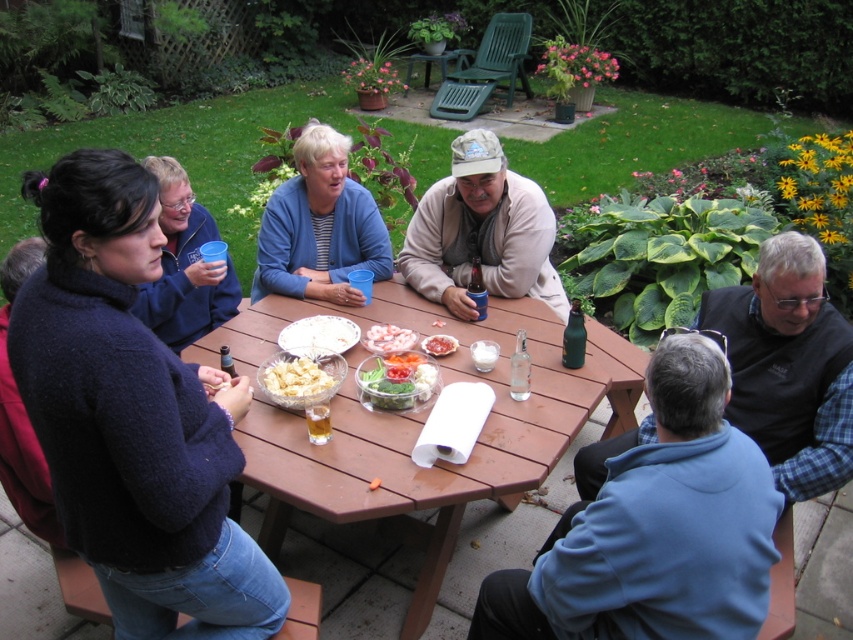
You are standing at the picnic table and want to reach both the point at coordinates point (776, 337) and point (363, 403). Which point is closer to you?

Point (363, 403) is closer to you because it is less further than point (776, 337).